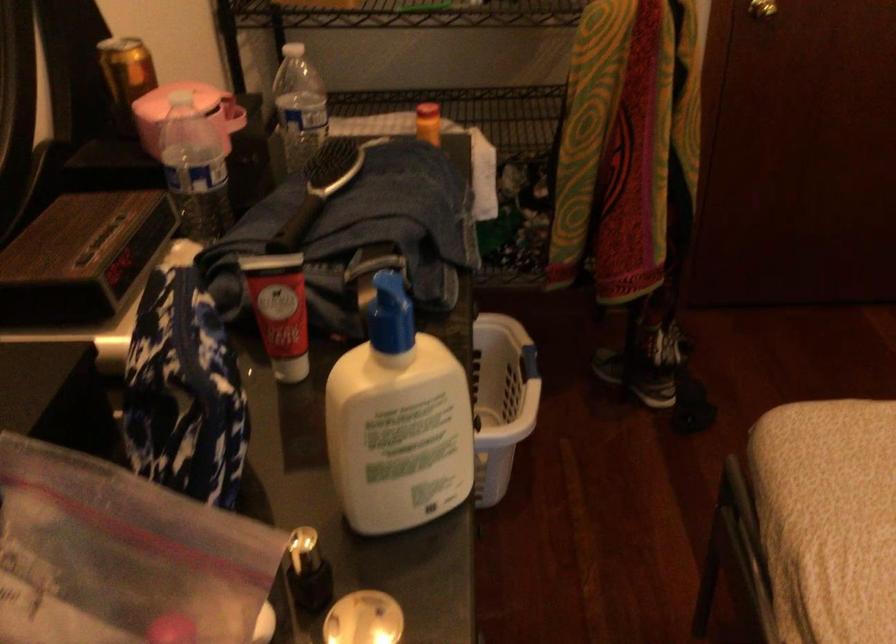
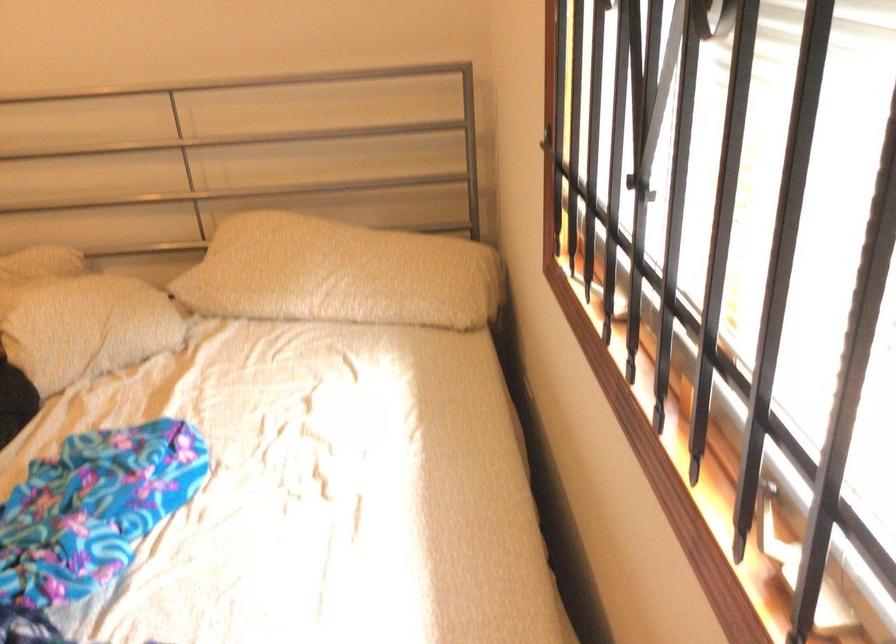
How did the camera likely rotate?

The camera's rotation is toward right-down.